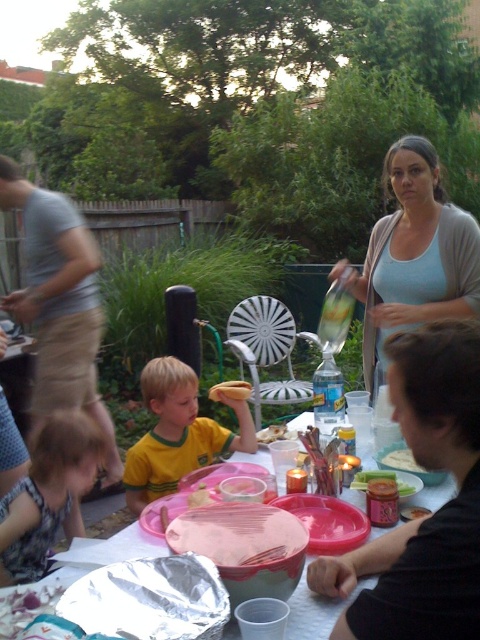
Question: Is printed fabric shirt at lower left below brown bread at center?

Choices:
 (A) yes
 (B) no

Answer: (A)

Question: Which object is positioned closest to the pink plastic plate at center?

Choices:
 (A) smooth plastic jar at center
 (B) light blue cotton tank top at center

Answer: (A)

Question: Which object is closer to the camera taking this photo?

Choices:
 (A) light blue cotton tank top at center
 (B) gray cotton shirt at left
 (C) green matte cucumber at center

Answer: (C)

Question: Among these objects, which one is nearest to the camera?

Choices:
 (A) golden crispy bread at center
 (B) light blue cotton tank top at center

Answer: (A)

Question: Does gray cotton shirt at left come behind smooth plastic jar at center?

Choices:
 (A) no
 (B) yes

Answer: (B)

Question: Does brown bread at center lie in front of golden crispy bread at center?

Choices:
 (A) no
 (B) yes

Answer: (A)